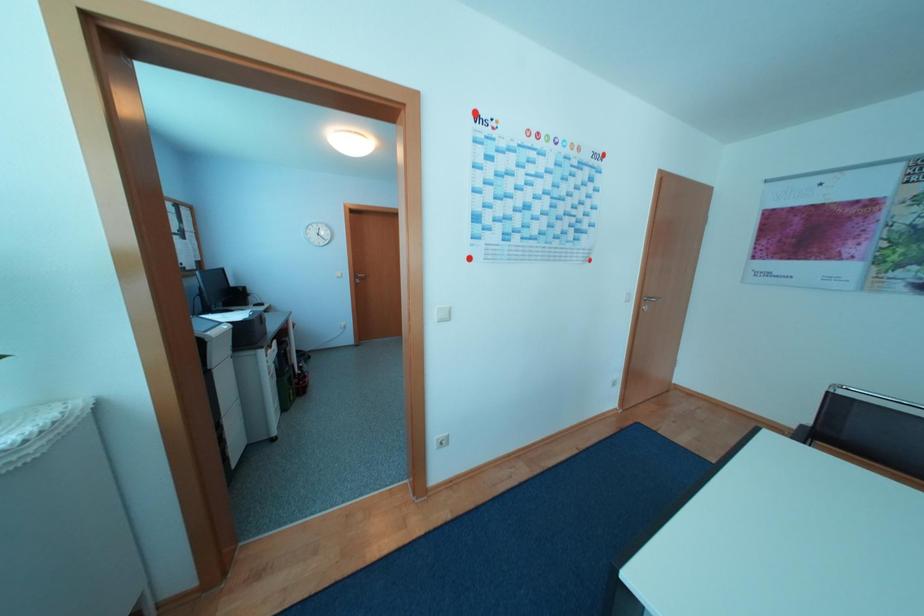
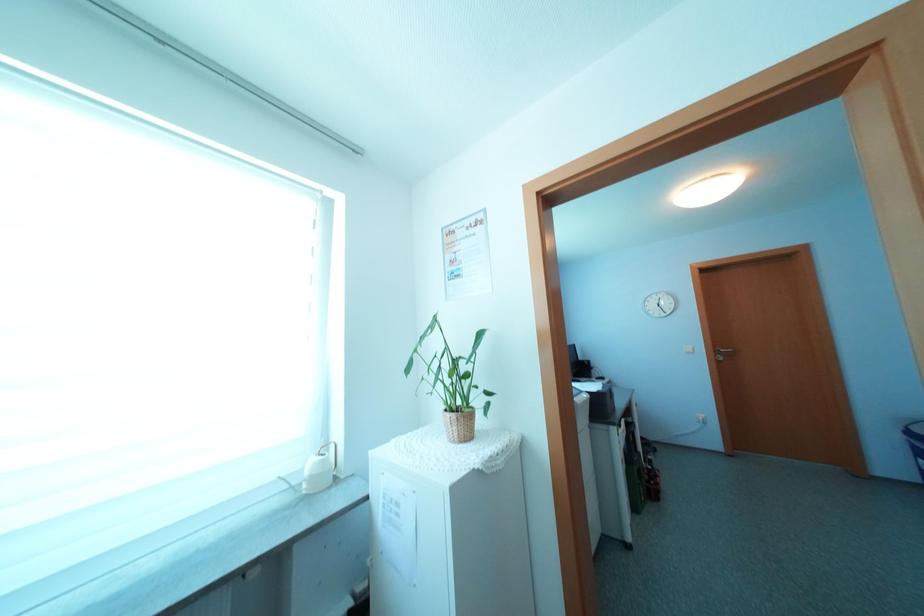
Question: The images are taken continuously from a first-person perspective. In which direction is your viewpoint rotating?

Choices:
 (A) Left
 (B) Right
 (C) Up
 (D) Down

Answer: (A)